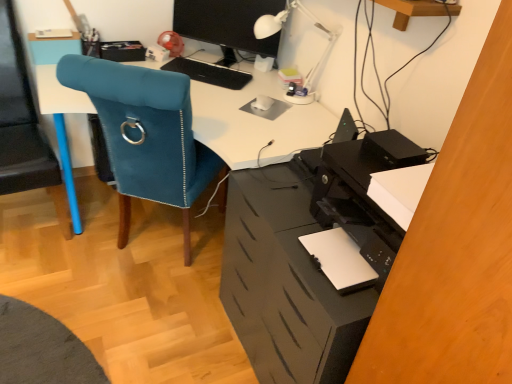
From the picture: In order to face black matte keyboard at center, should I rotate leftwards or rightwards?

To align with it, rotate left about 6.496°.

The height and width of the screenshot is (384, 512). Describe the element at coordinates (146, 135) in the screenshot. I see `velvet blue chair at left` at that location.

This screenshot has width=512, height=384. Describe the element at coordinates (24, 127) in the screenshot. I see `blue fabric chair at left` at that location.

Image resolution: width=512 pixels, height=384 pixels. Describe the element at coordinates (285, 283) in the screenshot. I see `black matte file cabinet at lower right` at that location.

This screenshot has width=512, height=384. What do you see at coordinates (315, 63) in the screenshot?
I see `white plastic table lamp at upper center` at bounding box center [315, 63].

The height and width of the screenshot is (384, 512). Find the location of `black matte keyboard at center`. black matte keyboard at center is located at coordinates (209, 73).

From the image's perspective, is matte black monitor at upper center over blue fabric chair at left?

Yes, from the image's perspective, matte black monitor at upper center is on top of blue fabric chair at left.

I want to click on computer monitor lying behind the blue fabric chair at left, so click(x=227, y=25).

Is matte black monitor at upper center closer to camera compared to blue fabric chair at left?

No, matte black monitor at upper center is further to the viewer.

Can you confirm if matte black monitor at upper center is bigger than blue fabric chair at left?

No, matte black monitor at upper center is not bigger than blue fabric chair at left.

Is point (222, 34) positioned after point (291, 3)?

Yes, it is behind point (291, 3).

In terms of size, does matte black monitor at upper center appear bigger or smaller than white plastic table lamp at upper center?

Clearly, matte black monitor at upper center is larger in size than white plastic table lamp at upper center.

Would you consider matte black monitor at upper center to be distant from white plastic table lamp at upper center?

No, matte black monitor at upper center is in close proximity to white plastic table lamp at upper center.

Can you confirm if black matte file cabinet at lower right is wider than white plastic table lamp at upper center?

Indeed, black matte file cabinet at lower right has a greater width compared to white plastic table lamp at upper center.

Looking at this image, considering the relative positions of black matte file cabinet at lower right and white plastic table lamp at upper center in the image provided, is black matte file cabinet at lower right to the right of white plastic table lamp at upper center from the viewer's perspective?

No, black matte file cabinet at lower right is not to the right of white plastic table lamp at upper center.

Which of these two, black matte file cabinet at lower right or white plastic table lamp at upper center, is bigger?

Bigger between the two is black matte file cabinet at lower right.

Is black matte keyboard at center at the back of black matte file cabinet at lower right?

black matte file cabinet at lower right does not have its back to black matte keyboard at center.

Who is bigger, black matte file cabinet at lower right or black matte keyboard at center?

black matte file cabinet at lower right is bigger.

Considering the positions of points (278, 169) and (219, 82), is point (278, 169) farther from camera compared to point (219, 82)?

That is False.

Looking at this image, is black matte file cabinet at lower right thinner than black matte keyboard at center?

No, black matte file cabinet at lower right is not thinner than black matte keyboard at center.

Identify the location of chair in front of the black matte keyboard at center. The height and width of the screenshot is (384, 512). (146, 135).

Would you say black matte keyboard at center is outside velvet blue chair at left?

Yes, black matte keyboard at center is located beyond the bounds of velvet blue chair at left.

Which of these two, black matte keyboard at center or velvet blue chair at left, stands taller?

With more height is velvet blue chair at left.

From a real-world perspective, between black matte keyboard at center and velvet blue chair at left, who is vertically higher?

black matte keyboard at center, from a real-world perspective.

Could you measure the distance between white plastic table lamp at upper center and matte black monitor at upper center?

12.02 inches.

In the image, there is a matte black monitor at upper center. In order to click on table lamp below it (from the image's perspective) in this screenshot , I will do `click(315, 63)`.

Which is more to the right, white plastic table lamp at upper center or matte black monitor at upper center?

white plastic table lamp at upper center.

From a real-world perspective, is white plastic table lamp at upper center physically above matte black monitor at upper center?

Correct, in the physical world, white plastic table lamp at upper center is higher than matte black monitor at upper center.

Is point (7, 84) positioned in front of point (204, 34)?

Yes, it is.

Consider the image. Can you confirm if blue fabric chair at left is positioned to the left of matte black monitor at upper center?

Yes.

Is blue fabric chair at left further to camera compared to matte black monitor at upper center?

No.

Based on the photo, considering the sizes of objects blue fabric chair at left and matte black monitor at upper center in the image provided, who is taller, blue fabric chair at left or matte black monitor at upper center?

With more height is blue fabric chair at left.

I want to click on computer chair to the left of matte black monitor at upper center, so click(24, 127).

Locate an element on the screen. The image size is (512, 384). computer monitor located above the white plastic table lamp at upper center (from the image's perspective) is located at coordinates (227, 25).

Estimate the real-world distances between objects in this image. Which object is further from blue fabric chair at left, black matte file cabinet at lower right or velvet blue chair at left?

Based on the image, black matte file cabinet at lower right appears to be further to blue fabric chair at left.

From the image, which object appears to be farther from matte black monitor at upper center, black matte file cabinet at lower right or white plastic table lamp at upper center?

black matte file cabinet at lower right is further to matte black monitor at upper center.

Considering their positions, is blue fabric chair at left positioned further to black matte keyboard at center than velvet blue chair at left?

Based on the image, blue fabric chair at left appears to be further to black matte keyboard at center.

Looking at the image, which one is located closer to black matte keyboard at center, black matte file cabinet at lower right or velvet blue chair at left?

Based on the image, velvet blue chair at left appears to be nearer to black matte keyboard at center.

Considering their positions, is velvet blue chair at left positioned further to black matte file cabinet at lower right than matte black monitor at upper center?

Based on the image, matte black monitor at upper center appears to be further to black matte file cabinet at lower right.

Considering their positions, is blue fabric chair at left positioned closer to matte black monitor at upper center than black matte file cabinet at lower right?

blue fabric chair at left lies closer to matte black monitor at upper center than the other object.

From the image, which object appears to be farther from matte black monitor at upper center, black matte file cabinet at lower right or blue fabric chair at left?

black matte file cabinet at lower right.

Considering their positions, is black matte file cabinet at lower right positioned closer to velvet blue chair at left than blue fabric chair at left?

Among the two, black matte file cabinet at lower right is located nearer to velvet blue chair at left.

At what (x,y) coordinates should I click in order to perform the action: click on chair between blue fabric chair at left and white plastic table lamp at upper center. Please return your answer as a coordinate pair (x, y). The height and width of the screenshot is (384, 512). Looking at the image, I should click on (146, 135).

I want to click on table lamp positioned between velvet blue chair at left and black matte keyboard at center from near to far, so click(315, 63).

The width and height of the screenshot is (512, 384). In order to click on keyboard between blue fabric chair at left and matte black monitor at upper center from left to right in this screenshot , I will do `click(209, 73)`.

Image resolution: width=512 pixels, height=384 pixels. Identify the location of keyboard between blue fabric chair at left and white plastic table lamp at upper center from left to right. (209, 73).